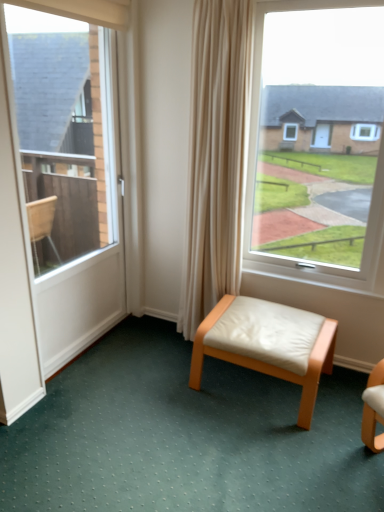
Identify the location of spots to the right of white glossy door at left. point(152,352).